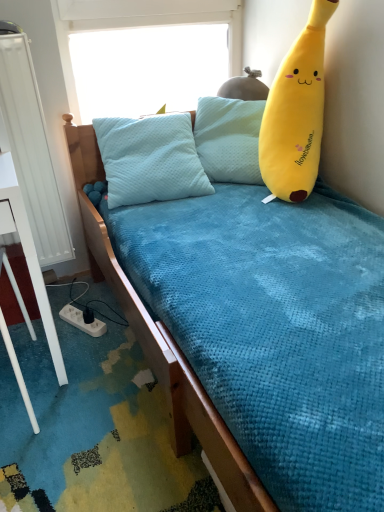
Question: Considering their positions, is transparent plastic window screen at upper center located in front of or behind white metallic radiator at left?

Choices:
 (A) front
 (B) behind

Answer: (B)

Question: From their relative heights in the image, would you say transparent plastic window screen at upper center is taller or shorter than white metallic radiator at left?

Choices:
 (A) short
 (B) tall

Answer: (A)

Question: Considering the real-world distances, which object is farthest from the white plastic power outlet at lower left?

Choices:
 (A) transparent plastic window screen at upper center
 (B) white metallic radiator at left
 (C) yellow plush toy at right

Answer: (A)

Question: Which of these objects is positioned farthest from the yellow plush toy at right?

Choices:
 (A) transparent plastic window screen at upper center
 (B) white metallic radiator at left
 (C) white plastic power outlet at lower left

Answer: (C)